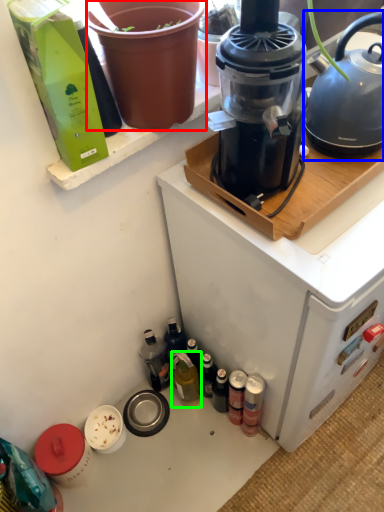
Question: Considering the real-world distances, which object is closest to flowerpot (highlighted by a red box)? kettle (highlighted by a blue box) or bottle (highlighted by a green box).

Choices:
 (A) kettle
 (B) bottle

Answer: (A)